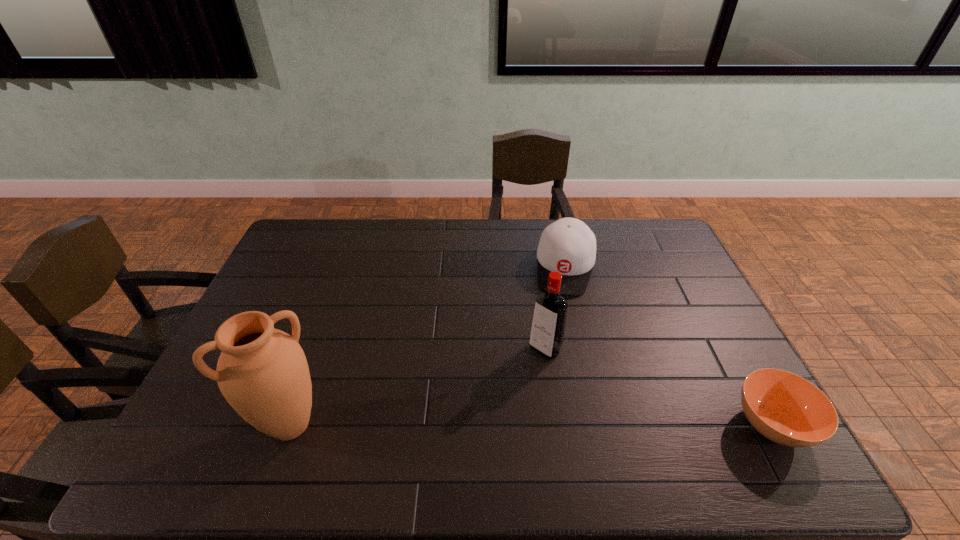
Locate an element on the screen. The height and width of the screenshot is (540, 960). free spot on the desktop that is between the urn and the rightmost object and is positioned on the front and back of the third nearest object is located at coordinates (470, 425).

Where is `vacant space on the desktop that is between the tallest object and the rightmost object and is positioned on the front-facing side of the third tallest object`? The image size is (960, 540). vacant space on the desktop that is between the tallest object and the rightmost object and is positioned on the front-facing side of the third tallest object is located at coordinates (542, 425).